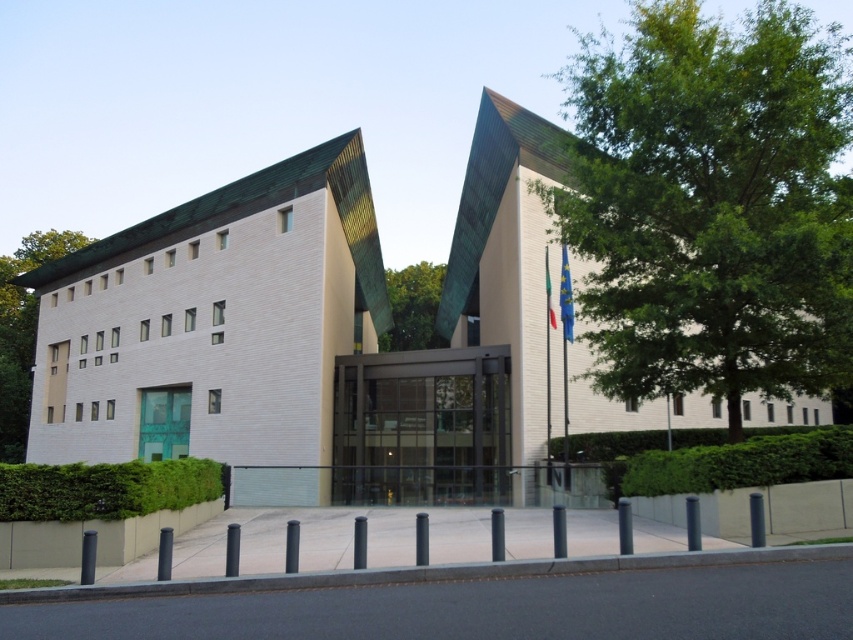
You are standing at the entrance of the modern building and want to reach the point marked at coordinates point (22, 330). Given that the point is 54.08 meters away from your current position, can you estimate how far you need to walk to reach it?

The point marked at coordinates point (22, 330) is 54.08 meters away from your current position, so you need to walk approximately 54.08 meters to reach it.

Consider the image. You are an architect reviewing the building design and notice two green leafy trees in the image. Which tree has a greater width between the green leafy tree at upper right and the green leafy tree at center?

The green leafy tree at upper right has a greater width than the green leafy tree at center.